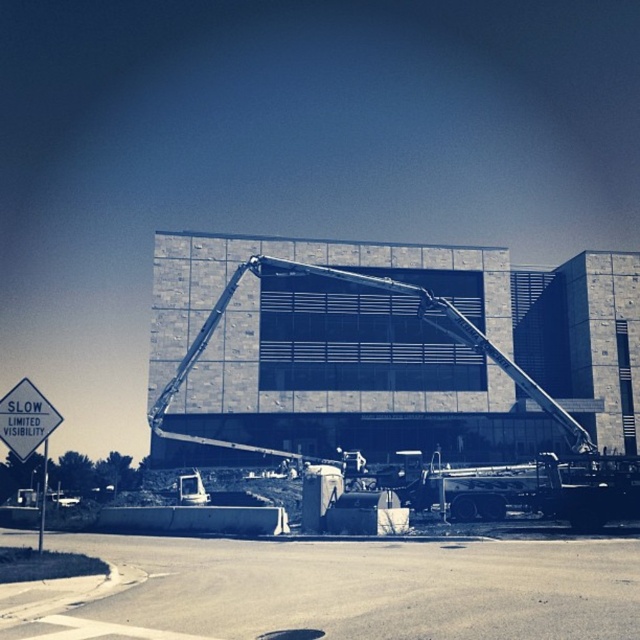
You are standing at the construction site looking at the crane and the building. There are two points marked on the crane arm, one at coordinates point [182,436] and the other at point [16,429]. Which point is closer to you?

Point [182,436] is further to the viewer than point [16,429], so the point closer to you is point [16,429].

You are a construction worker standing at the entrance of the construction site. You need to determine which object is taller between the metallic gray crane at center and the white plastic sign at upper left. Based on the scene, which one is taller?

The metallic gray crane at center is taller than the white plastic sign at upper left according to the description.